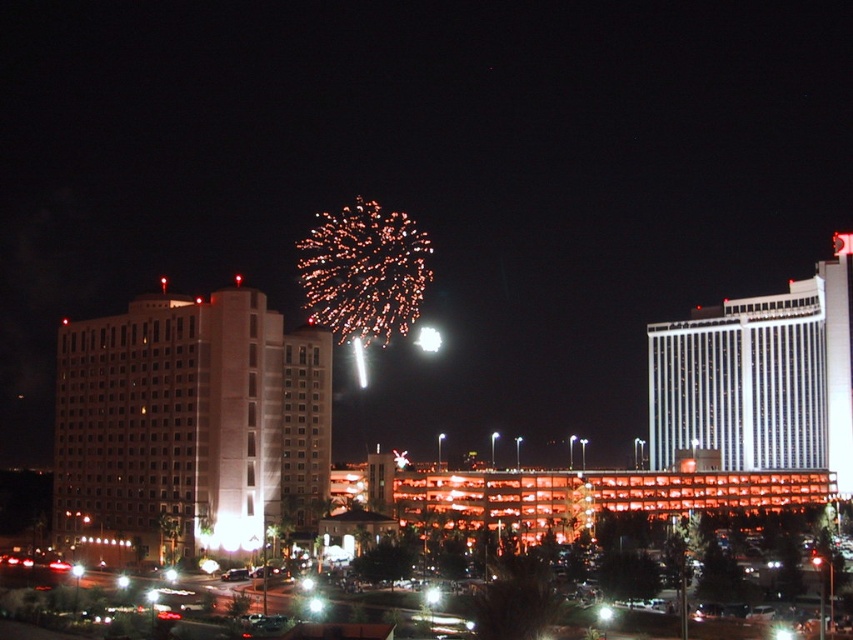
Question: Is matte white building at left to the left of white glossy building at upper right from the viewer's perspective?

Choices:
 (A) no
 (B) yes

Answer: (B)

Question: Can you confirm if matte white building at left is thinner than white glossy building at upper right?

Choices:
 (A) yes
 (B) no

Answer: (A)

Question: Which point is farther to the camera?

Choices:
 (A) matte white building at left
 (B) white glossy building at upper right

Answer: (B)

Question: Which of the following is the farthest from the observer?

Choices:
 (A) (305, 506)
 (B) (749, 385)

Answer: (B)

Question: Is matte white building at left thinner than white glossy building at upper right?

Choices:
 (A) no
 (B) yes

Answer: (B)

Question: Which object appears closest to the camera in this image?

Choices:
 (A) matte white building at left
 (B) white glossy building at upper right

Answer: (A)